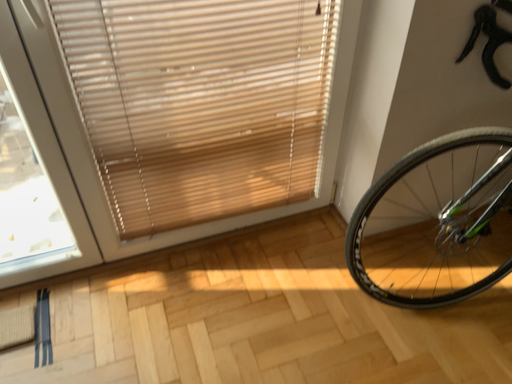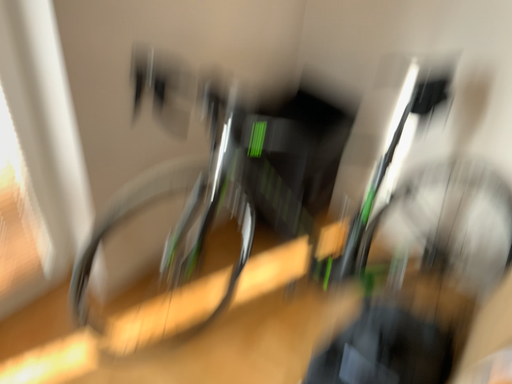
Question: How did the camera likely rotate when shooting the video?

Choices:
 (A) rotated right
 (B) rotated left

Answer: (A)